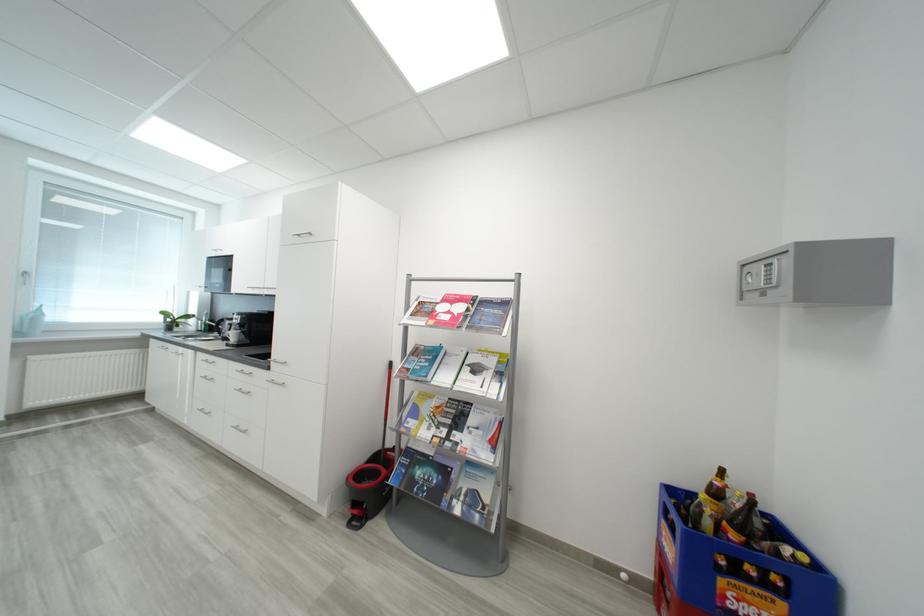
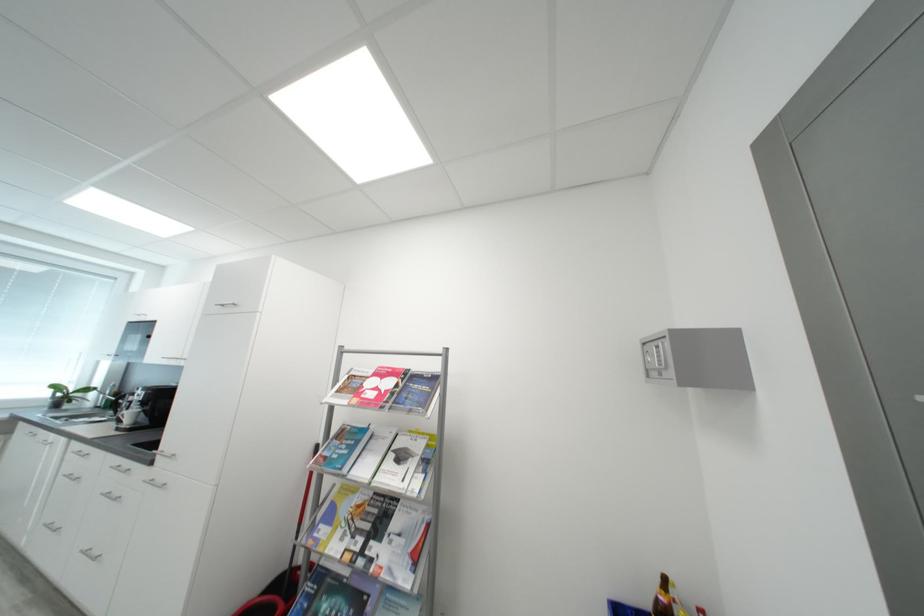
Locate, in the second image, the point that corresponds to pixel 306 237 in the first image.

(228, 307)